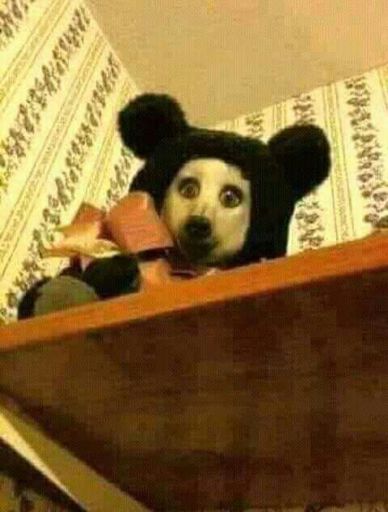
Identify the location of edge of shelf. (248, 284).